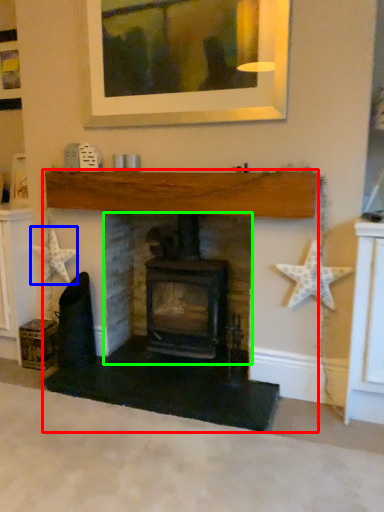
Question: Considering the real-world distances, which object is closest to fireplace (highlighted by a red box)? starfish (highlighted by a blue box) or fireplace (highlighted by a green box).

Choices:
 (A) starfish
 (B) fireplace

Answer: (B)